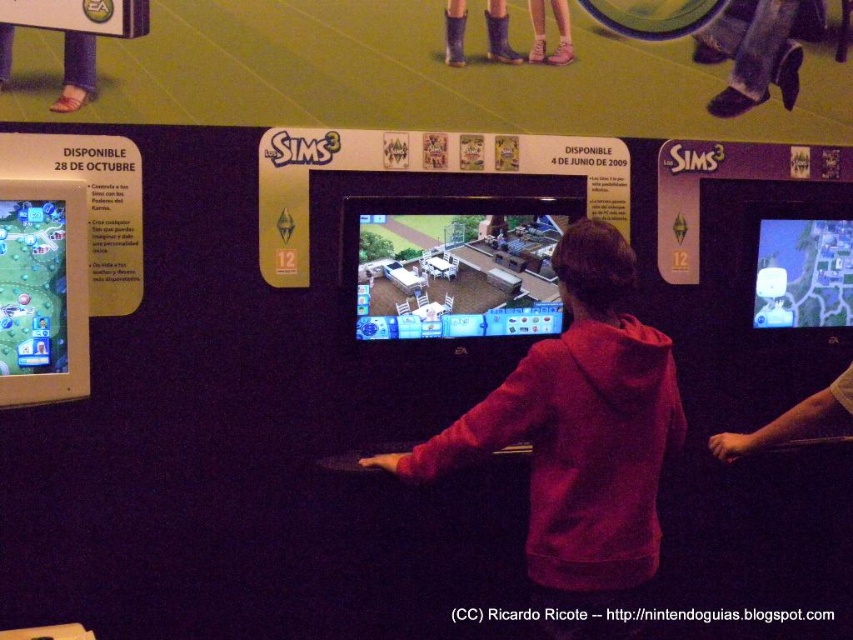
You are a game developer trying to design a new interface for a motion control game. You need to ensure that the distance between the matte green map at left and the white matte hand at center is sufficient for comfortable interaction. Given that the recommended minimum distance for such interactions is 6 feet, can the current setup accommodate this requirement?

The matte green map at left and white matte hand at center are 6.87 feet apart from each other, which exceeds the recommended minimum distance of 6 feet. Therefore, the current setup can accommodate the requirement.

Please provide the 2D coordinates of the matte plastic screen at center as observed in the scene.

The 2D coordinates of the matte plastic screen at center are at point (451, 269).

You are a game developer designing a motion control system for The Sims 3. You need to ensure that the distance between the red hoodie at center and the white matte hand at center is sufficient for accurate gesture recognition. What is the minimum distance required between these two objects to ensure proper functionality?

The minimum distance required between the red hoodie at center and the white matte hand at center is 25.09 inches to ensure proper functionality for accurate gesture recognition.